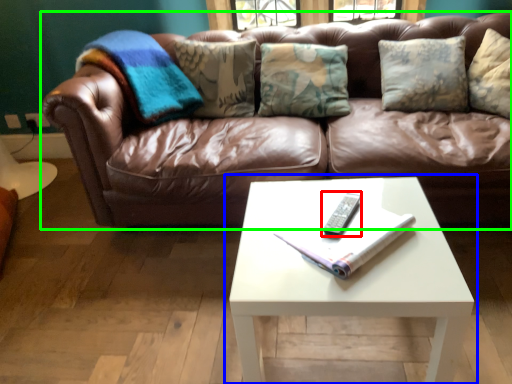
Question: Based on their relative distances, which object is farther from remote (highlighted by a red box)? Choose from coffee table (highlighted by a blue box) and studio couch (highlighted by a green box).

Choices:
 (A) coffee table
 (B) studio couch

Answer: (B)